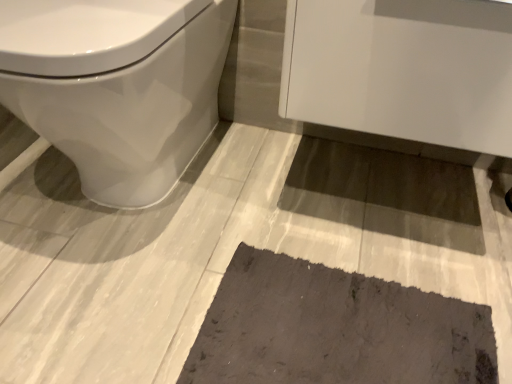
I want to click on free space underneath white glossy cabinet at upper right (from a real-world perspective), so click(372, 182).